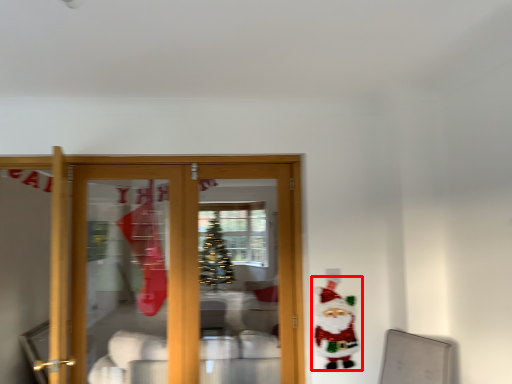
Question: Where is santa claus (annotated by the red box) located in relation to furniture in the image?

Choices:
 (A) left
 (B) right

Answer: (B)